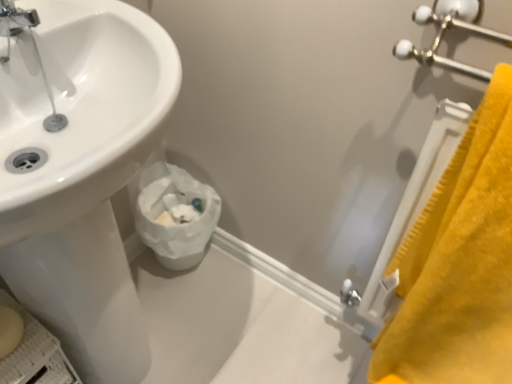
Question: Considering the positions of point (148, 238) and point (470, 153), is point (148, 238) closer or farther from the camera than point (470, 153)?

Choices:
 (A) closer
 (B) farther

Answer: (B)

Question: From the image's perspective, is white paper at lower center positioned above or below yellow plush bath towel at right?

Choices:
 (A) below
 (B) above

Answer: (A)

Question: Which object is positioned closest to the yellow plush bath towel at right?

Choices:
 (A) chrome metallic faucet at upper left
 (B) white paper at lower center

Answer: (B)

Question: Which of these objects is positioned closest to the chrome metallic faucet at upper left?

Choices:
 (A) yellow plush bath towel at right
 (B) white paper at lower center

Answer: (B)